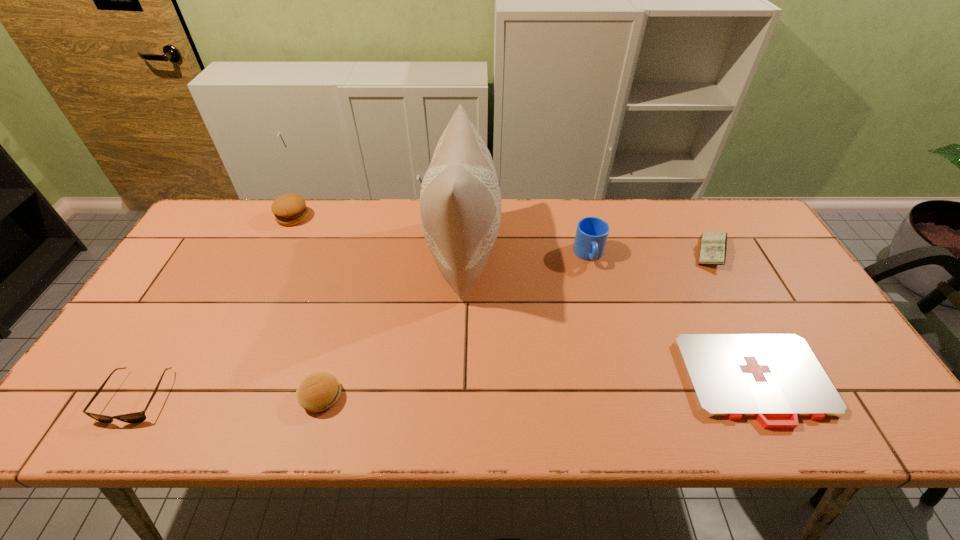
Image resolution: width=960 pixels, height=540 pixels. I want to click on the first-aid kit, so click(730, 375).

Locate an element on the screen. free space located 0.260m on the front side of the fourth object from left to right is located at coordinates (587, 252).

Find the location of a particular element. vacant space located 0.230m on the side of the mug with the handle is located at coordinates (609, 334).

Find the location of a particular element. free location located on the front of the hamburger is located at coordinates [x=262, y=282].

Where is `vacant space located on the front of the diary`? The height and width of the screenshot is (540, 960). vacant space located on the front of the diary is located at coordinates (747, 318).

At what (x,y) coordinates should I click in order to perform the action: click on vacant space situated 0.290m on the left of the patty. Please return your answer as a coordinate pair (x, y). Looking at the image, I should click on (171, 396).

Locate an element on the screen. cushion present at the far edge is located at coordinates (460, 200).

I want to click on mug positioned at the far edge, so click(x=591, y=235).

Identify the location of hamburger that is at the far edge. (289, 209).

This screenshot has width=960, height=540. I want to click on diary situated at the far edge, so click(x=713, y=247).